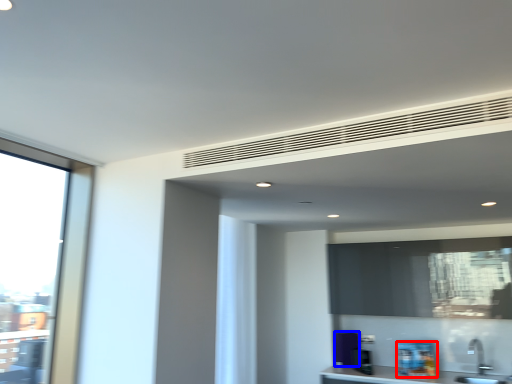
Question: Which point is further to the camera, appliance (highlighted by a red box) or appliance (highlighted by a blue box)?

Choices:
 (A) appliance
 (B) appliance

Answer: (B)